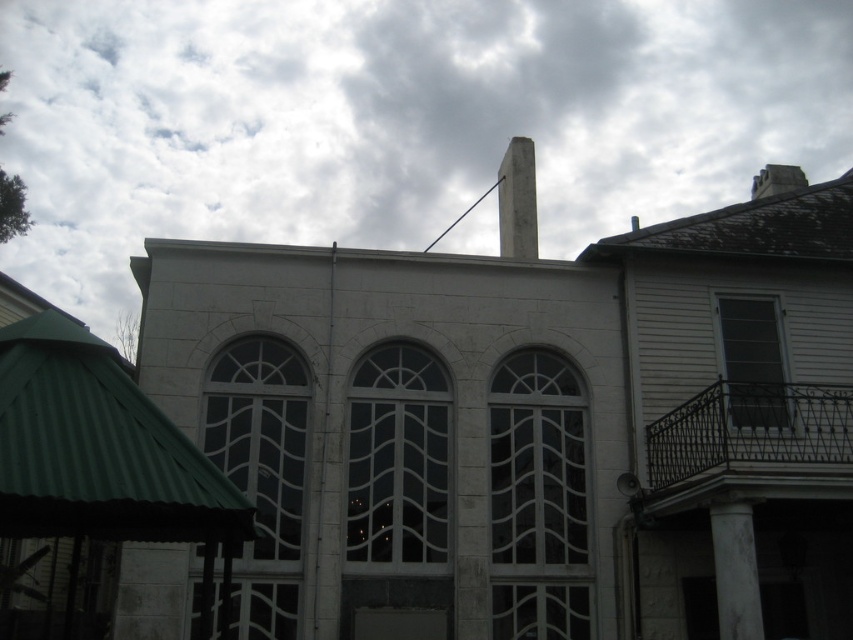
You are standing in front of the building and notice the white cloudy sky at upper center and the white stone column at lower right. Which object is positioned more to the left side of the scene?

The white cloudy sky at upper center is positioned more to the left side of the scene compared to the white stone column at lower right.

Looking at this image, you are an architect analyzing the building facade. Which object, the white cloudy sky at upper center or the white stone column at lower right, occupies more visual space in the image?

The white cloudy sky at upper center has a larger size compared to the white stone column at lower right, so it occupies more visual space in the image.

You are standing in front of the building and want to know if the green corrugated metal canopy at lower left can block the view of the concrete at center. Based on their heights, can it?

The green corrugated metal canopy at lower left is not as tall as concrete at center, so it cannot block the view of the concrete at center.